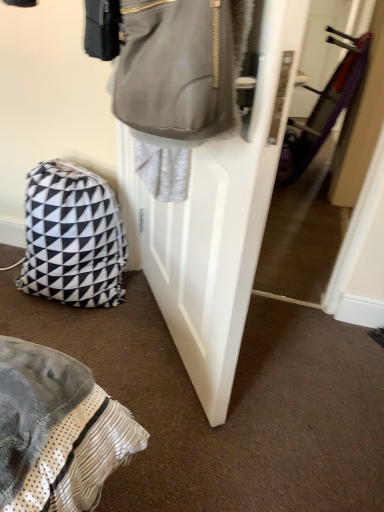
Question: From the image's perspective, relative to matte gray door at center, is black and white geometric fabric backpack at lower left above or below?

Choices:
 (A) below
 (B) above

Answer: (A)

Question: Is black and white geometric fabric backpack at lower left wider or thinner than matte gray door at center?

Choices:
 (A) wide
 (B) thin

Answer: (A)

Question: From their relative heights in the image, would you say black and white geometric fabric backpack at lower left is taller or shorter than matte gray door at center?

Choices:
 (A) tall
 (B) short

Answer: (B)

Question: From a real-world perspective, is matte gray door at center physically located above or below black and white geometric fabric backpack at lower left?

Choices:
 (A) below
 (B) above

Answer: (B)

Question: From their relative heights in the image, would you say matte gray door at center is taller or shorter than black and white geometric fabric backpack at lower left?

Choices:
 (A) short
 (B) tall

Answer: (B)

Question: From the image's perspective, is matte gray door at center positioned above or below black and white geometric fabric backpack at lower left?

Choices:
 (A) above
 (B) below

Answer: (A)

Question: Considering the positions of matte gray door at center and black and white geometric fabric backpack at lower left in the image, is matte gray door at center bigger or smaller than black and white geometric fabric backpack at lower left?

Choices:
 (A) small
 (B) big

Answer: (B)